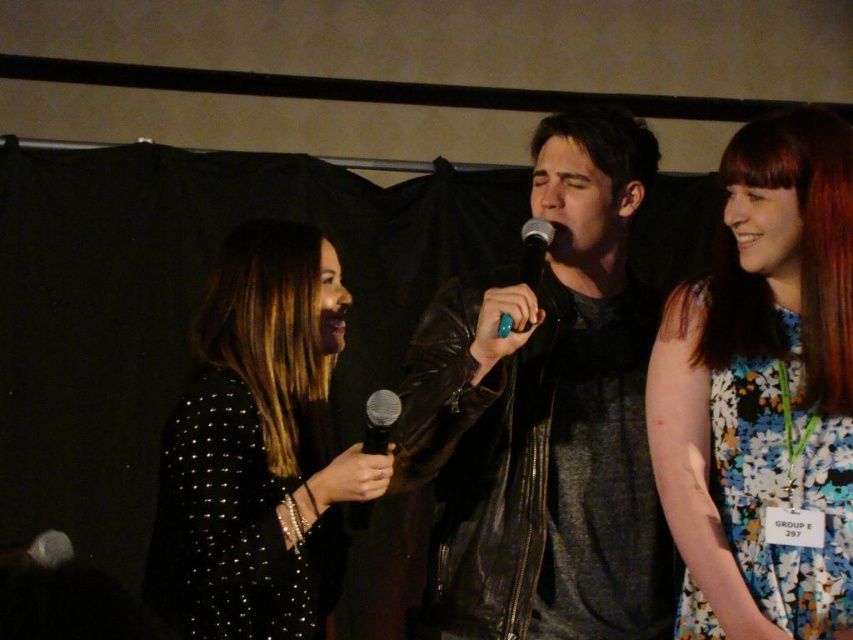
Which is in front, point (558, 476) or point (699, 515)?

Point (699, 515) is in front.

Does point (434, 339) come behind point (824, 138)?

Yes, point (434, 339) is farther from viewer.

Identify the location of leather jacket at center. (544, 417).

Can you confirm if black sequined dress at left is positioned below matte black microphone at center?

Yes.

Which of these two, black sequined dress at left or matte black microphone at center, stands taller?

black sequined dress at left is taller.

Is point (308, 276) closer to viewer compared to point (550, 237)?

No, it is behind (550, 237).

Where is `black sequined dress at left`? Image resolution: width=853 pixels, height=640 pixels. black sequined dress at left is located at coordinates tap(258, 449).

Is black matte microphone at center smaller than matte black microphone at center?

Incorrect, black matte microphone at center is not smaller in size than matte black microphone at center.

Is black matte microphone at center closer to the viewer compared to matte black microphone at center?

That is False.

What do you see at coordinates (379, 420) in the screenshot? I see `black matte microphone at center` at bounding box center [379, 420].

The height and width of the screenshot is (640, 853). What are the coordinates of `black matte microphone at center` in the screenshot? It's located at (379, 420).